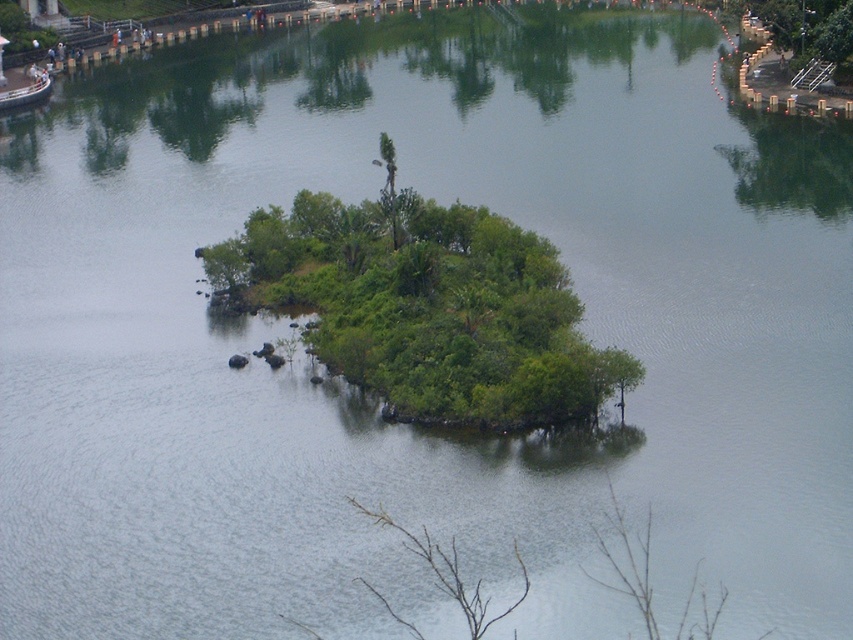
Describe the element at coordinates (426, 305) in the screenshot. I see `green leafy tree at center` at that location.

Is green leafy tree at center in front of metallic silver boat at upper left?

Yes, green leafy tree at center is in front of metallic silver boat at upper left.

Where is `green leafy tree at center`? This screenshot has height=640, width=853. green leafy tree at center is located at coordinates click(426, 305).